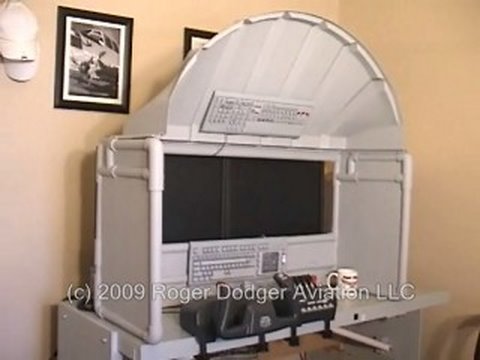
This screenshot has width=480, height=360. I want to click on steering wheel maybe for gaming, so click(x=223, y=324), click(x=223, y=298), click(x=248, y=328), click(x=257, y=294), click(x=294, y=322), click(x=285, y=290).